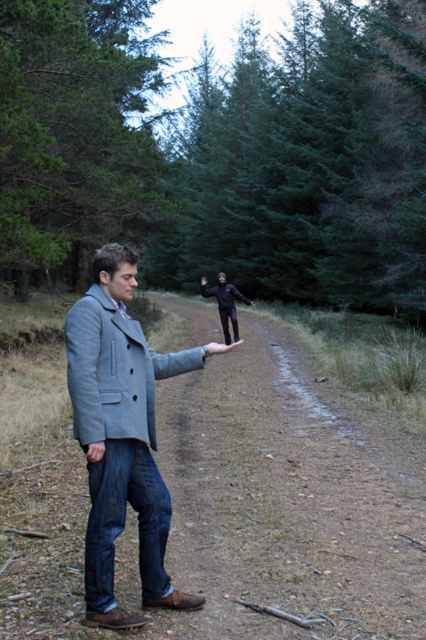
Question: Which object appears closest to the camera in this image?

Choices:
 (A) gray wool coat at center
 (B) brown dirt track at center

Answer: (A)

Question: Considering the relative positions of green textured pine forest at upper center and gray wool coat at center in the image provided, where is green textured pine forest at upper center located with respect to gray wool coat at center?

Choices:
 (A) left
 (B) right

Answer: (A)

Question: Is brown dirt track at center to the right of black matte pants at center from the viewer's perspective?

Choices:
 (A) yes
 (B) no

Answer: (B)

Question: Which point is closer to the camera?

Choices:
 (A) (69, 589)
 (B) (100, 621)

Answer: (B)

Question: Is green textured pine forest at upper center bigger than black matte pants at center?

Choices:
 (A) yes
 (B) no

Answer: (A)

Question: Among these points, which one is farthest from the camera?

Choices:
 (A) (294, 38)
 (B) (227, 336)

Answer: (A)